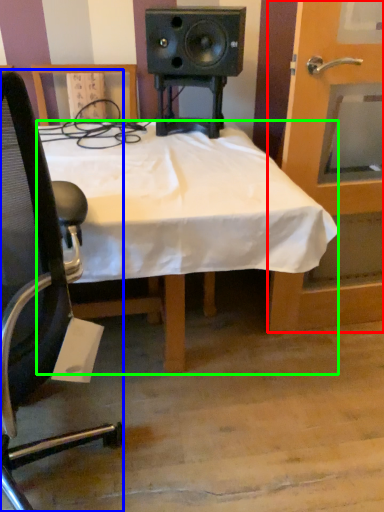
Question: Considering the real-world distances, which object is closest to door (highlighted by a red box)? chair (highlighted by a blue box) or desk (highlighted by a green box).

Choices:
 (A) chair
 (B) desk

Answer: (B)